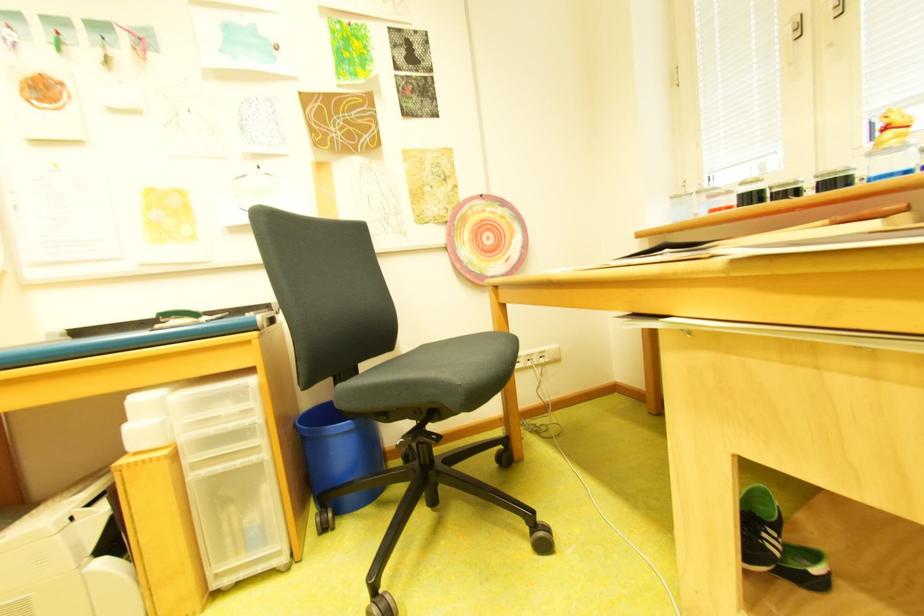
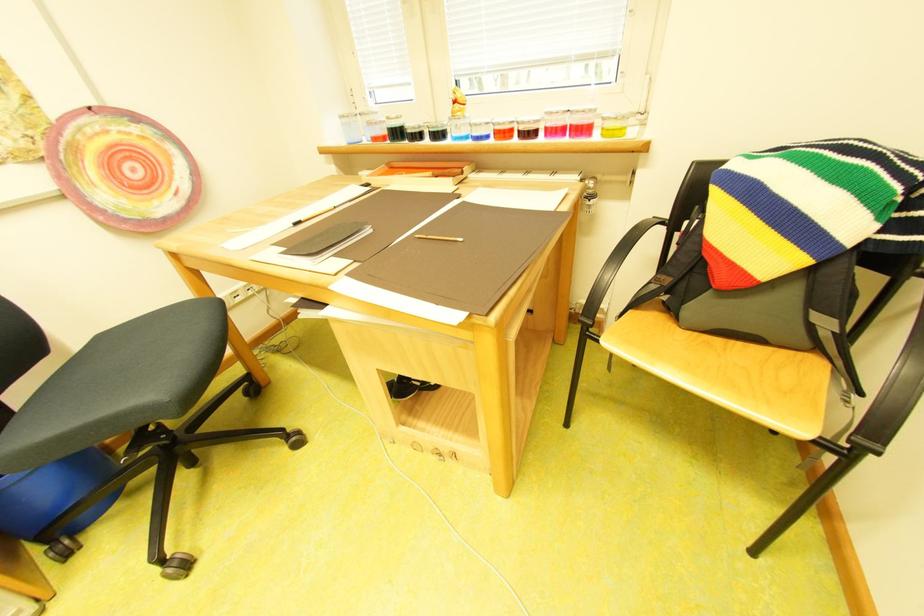
Locate, in the second image, the point that corresponds to point 839,223 in the first image.

(441, 175)